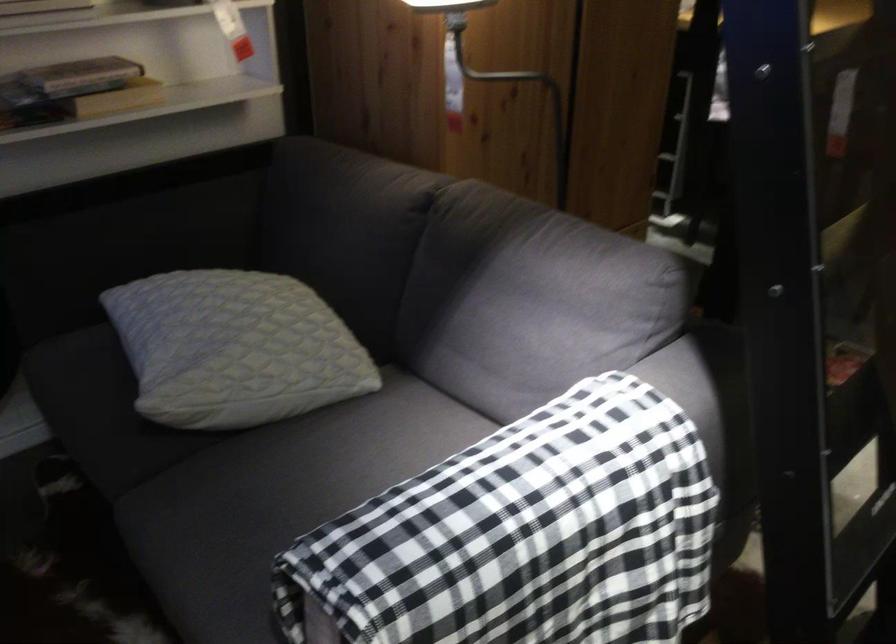
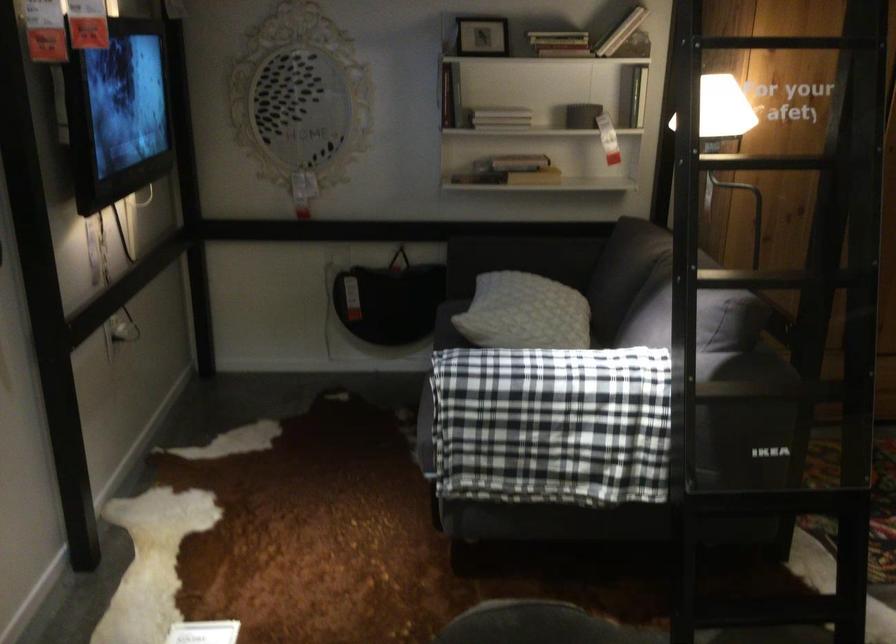
Where in the second image is the point corresponding to pixel 90 117 from the first image?

(509, 171)